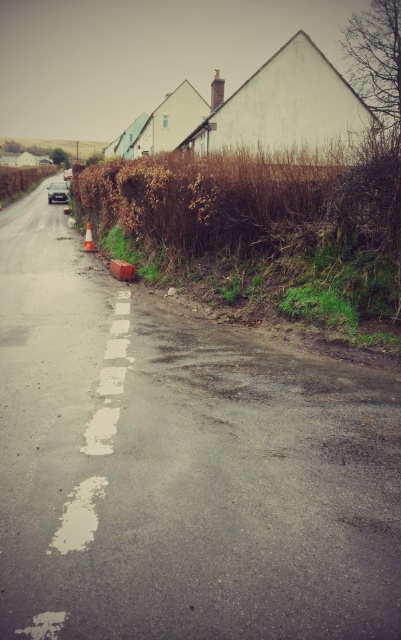
Question: Estimate the real-world distances between objects in this image. Which object is closer to the brown dry hedge at upper right?

Choices:
 (A) brown dry hedge at left
 (B) shiny silver car at left

Answer: (B)

Question: Which object appears farthest from the camera in this image?

Choices:
 (A) shiny silver car at left
 (B) brown dry hedge at upper right
 (C) brown dry hedge at left

Answer: (C)

Question: Among these objects, which one is nearest to the camera?

Choices:
 (A) shiny silver car at left
 (B) brown dry hedge at left
 (C) orange reflective cone at lower center
 (D) brown dry hedge at upper right

Answer: (D)

Question: Observing the image, what is the correct spatial positioning of brown dry hedge at upper right in reference to brown dry hedge at left?

Choices:
 (A) below
 (B) above

Answer: (A)

Question: Does brown dry hedge at left lie behind shiny silver car at left?

Choices:
 (A) no
 (B) yes

Answer: (B)

Question: Can you confirm if brown dry hedge at left is positioned below shiny silver car at left?

Choices:
 (A) yes
 (B) no

Answer: (B)